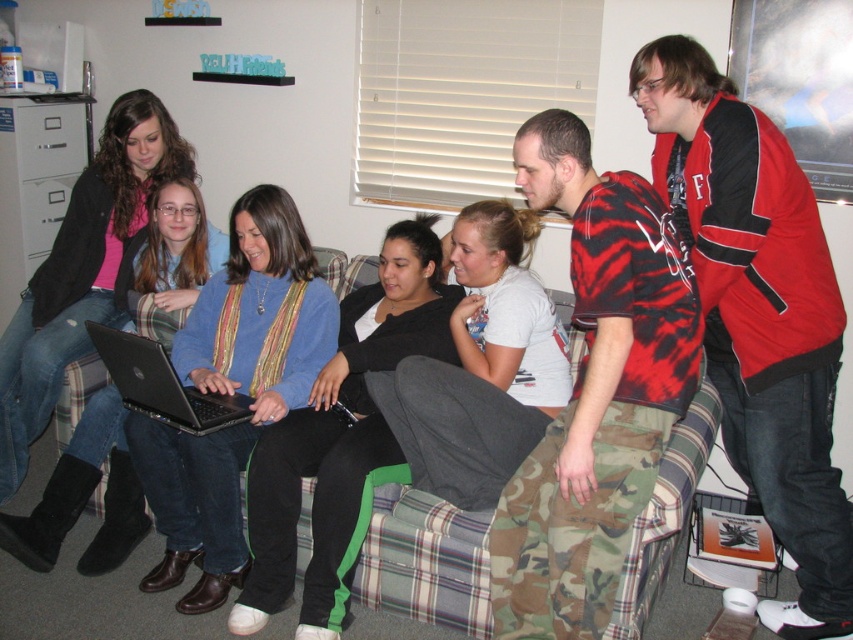
Consider the image. You are standing at the entrance of the room and want to hand the red jacket at upper right to someone. Based on its position, where should you go to reach it?

The red jacket at upper right is located at point (x=758, y=314), which is near the upper right corner of the room. To reach it, you should move towards the upper right area of the room where the jacket is positioned.